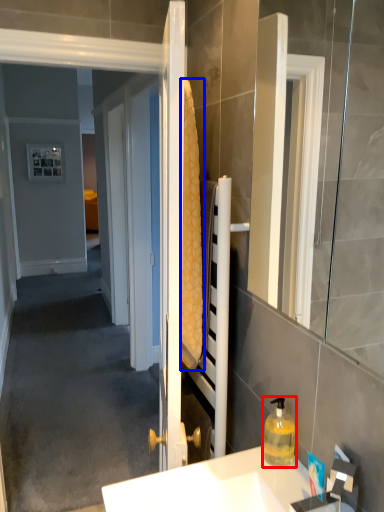
Question: Which of the following is the farthest to the observer, bottle (highlighted by a red box) or bath towel (highlighted by a blue box)?

Choices:
 (A) bottle
 (B) bath towel

Answer: (A)